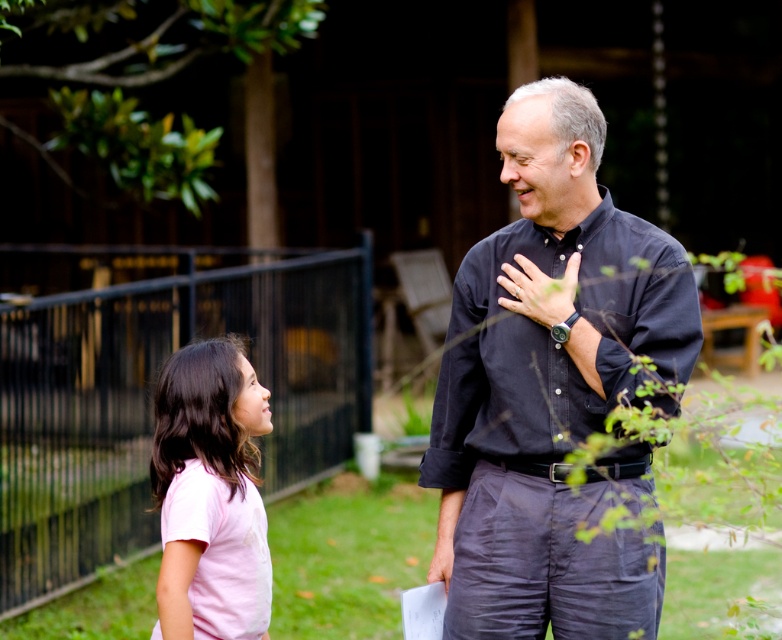
Question: Does dark blue shirt at center have a smaller size compared to pink cotton shirt at lower left?

Choices:
 (A) no
 (B) yes

Answer: (A)

Question: Which object appears closest to the camera in this image?

Choices:
 (A) dark blue shirt at center
 (B) matte black watch at center
 (C) pink cotton shirt at lower left

Answer: (A)

Question: Which object is farther from the camera taking this photo?

Choices:
 (A) pink cotton shirt at lower left
 (B) matte black watch at center

Answer: (B)

Question: Which point is farther to the camera?

Choices:
 (A) (189, 595)
 (B) (468, 442)

Answer: (B)

Question: Is dark blue shirt at center thinner than matte black watch at center?

Choices:
 (A) yes
 (B) no

Answer: (B)

Question: Is dark blue shirt at center below pink cotton shirt at lower left?

Choices:
 (A) yes
 (B) no

Answer: (B)